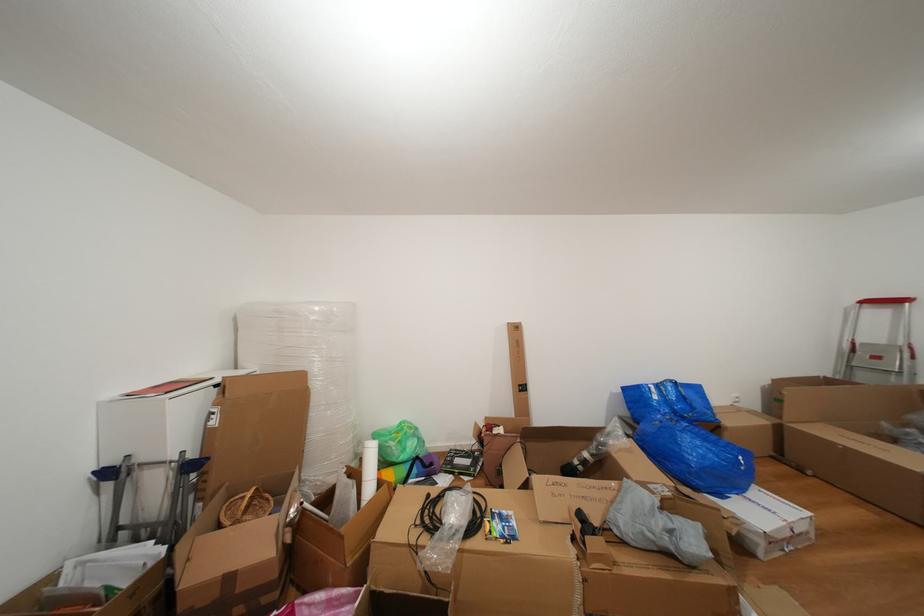
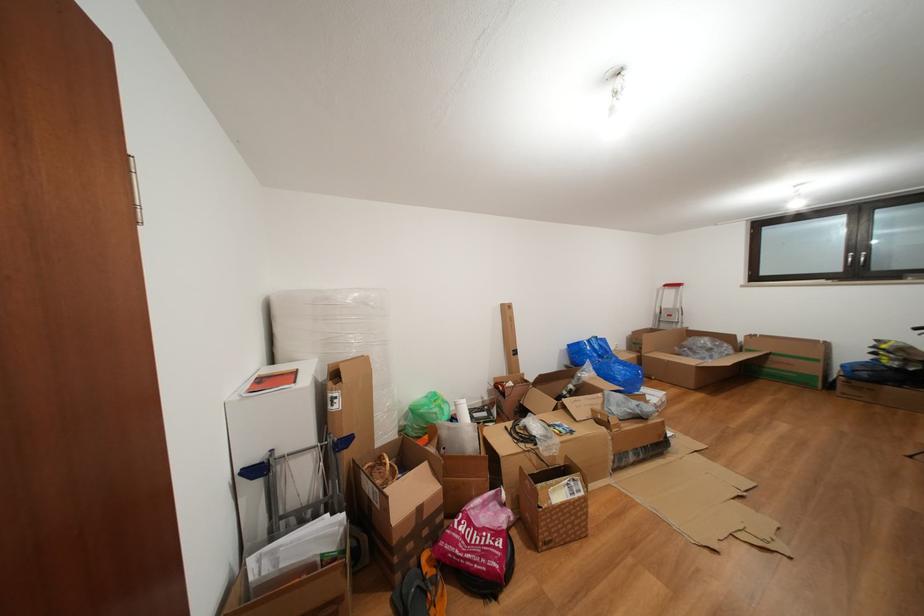
Find the pixel in the second image that matches the point at 222,419 in the first image.

(344, 403)